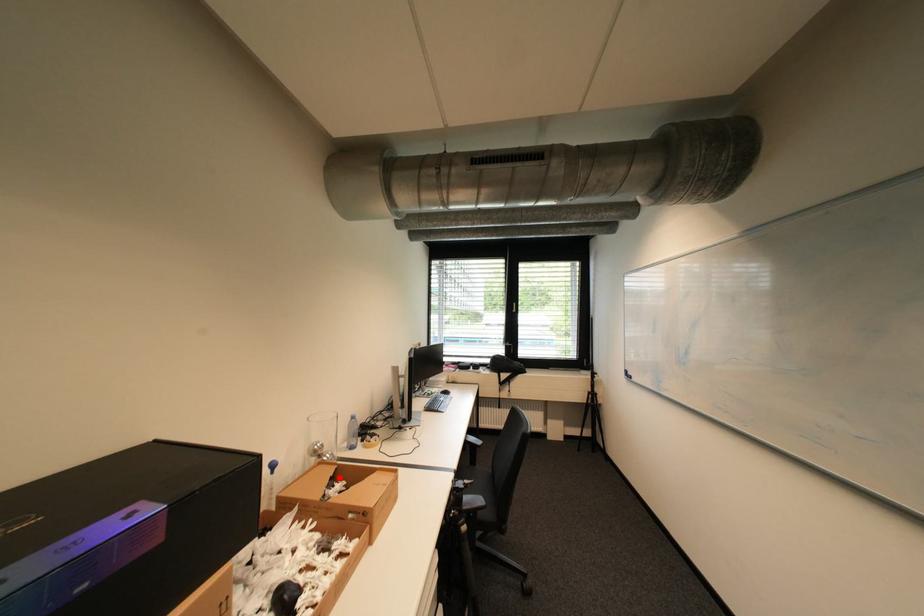
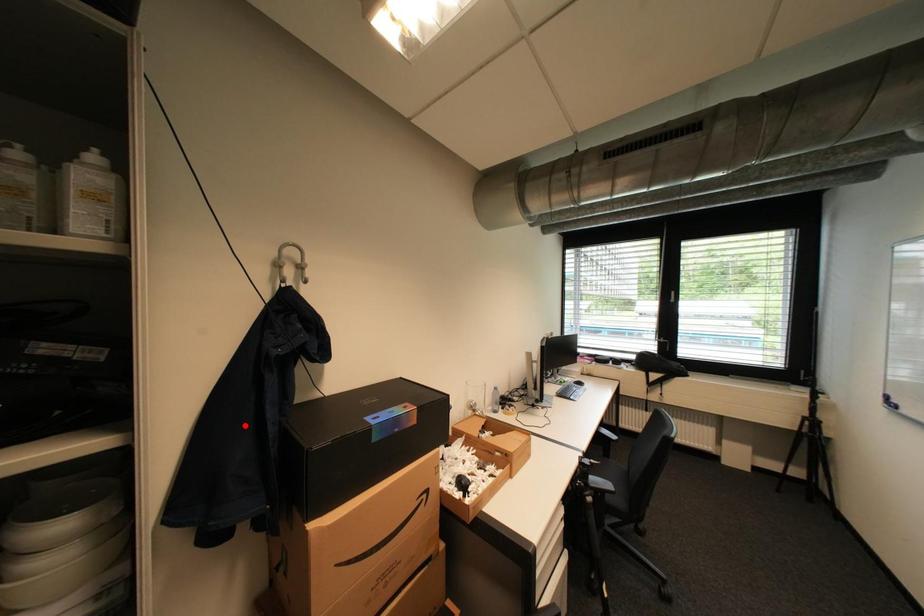
I am providing you with two images of the same scene from different viewpoints. A red point is marked on the first image and another point is marked on the second image. Is the red point in image1 aligned with the point shown in image2?

No